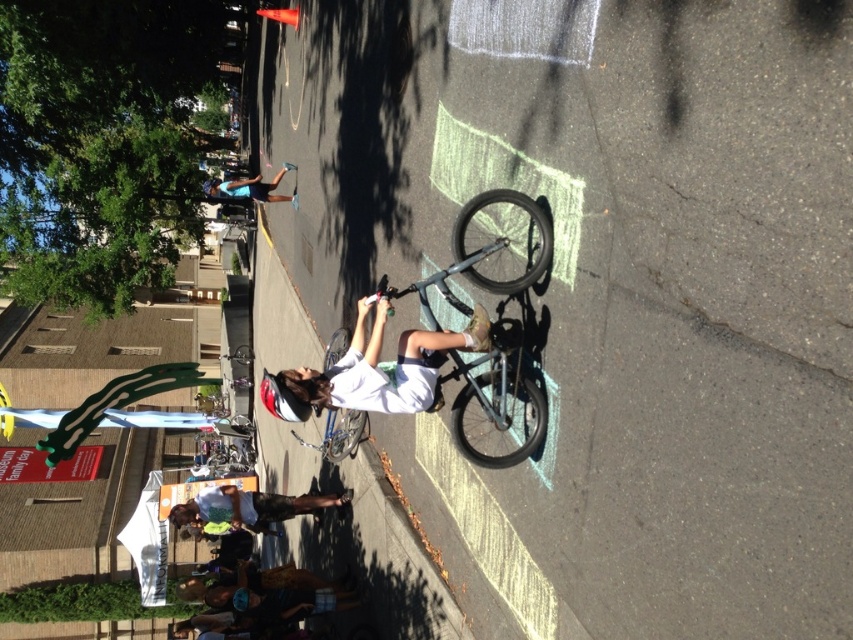
Question: Is white matte shirt at center further to camera compared to blue fabric shirt at upper center?

Choices:
 (A) no
 (B) yes

Answer: (A)

Question: Which point is farther to the camera?

Choices:
 (A) (306, 371)
 (B) (212, 499)
 (C) (537, 440)

Answer: (B)

Question: Which object appears farthest from the camera in this image?

Choices:
 (A) white t-shirt at center
 (B) blue fabric shirt at upper center
 (C) shiny metallic bicycle at center

Answer: (B)

Question: Does shiny metallic bicycle at center appear over blue fabric shirt at upper center?

Choices:
 (A) yes
 (B) no

Answer: (B)

Question: Which point is farther to the camera?

Choices:
 (A) (236, 524)
 (B) (219, 192)
 (C) (538, 419)

Answer: (B)

Question: Can you confirm if white matte shirt at center is positioned below shiny metallic bicycle at center?

Choices:
 (A) yes
 (B) no

Answer: (A)